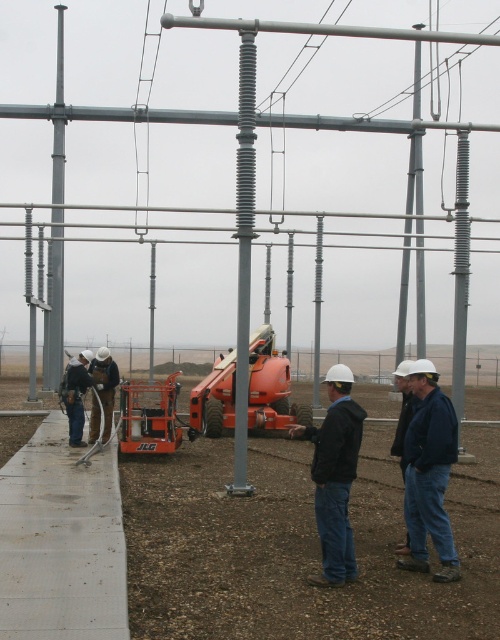
You are an inspector standing on the dirt ground in the foreground. You need to check the condition of the gray metallic pole at left and the orange metallic lift at center. Which object is higher from the ground? Please answer based on their positions in the image.

The gray metallic pole at left is located above the orange metallic lift at center, so the gray metallic pole at left is higher from the ground than the orange metallic lift at center.

You are an inspector checking the substation. You notice the black matte jacket at center and the gray rubberized insulator at right. Which object has a smaller width?

The black matte jacket at center is thinner than the gray rubberized insulator at right, so the black matte jacket at center has a smaller width.

You are a safety inspector at the substation. You need to ensure that the black matte jacket at center and the gray rubberized insulator at right are visible to workers from a distance. Based on their sizes, which object is more likely to be easily noticed by the workers?

The gray rubberized insulator at right is more likely to be easily noticed because it occupies more space than the black matte jacket at center.